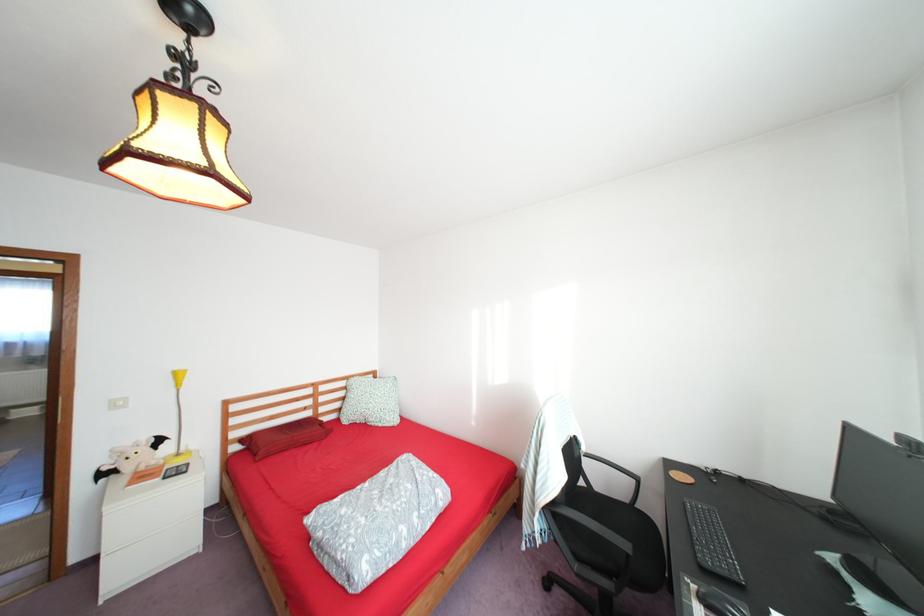
Identify the location of black computer mouse. This screenshot has height=616, width=924. (719, 602).